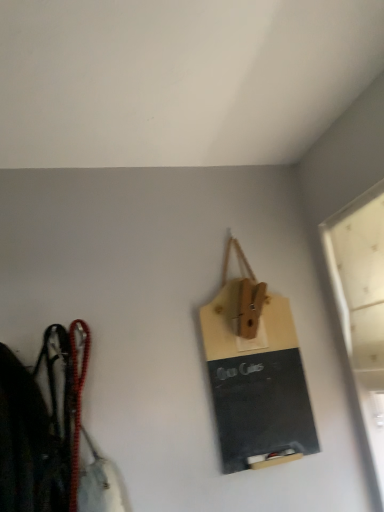
Describe the element at coordinates (256, 374) in the screenshot. This screenshot has height=512, width=384. I see `matte black chalkboard at center` at that location.

Image resolution: width=384 pixels, height=512 pixels. I want to click on matte black chalkboard at center, so click(256, 374).

Image resolution: width=384 pixels, height=512 pixels. What do you see at coordinates (362, 305) in the screenshot?
I see `white frosted glass window at upper right` at bounding box center [362, 305].

Measure the distance between point (372, 400) and camera.

Point (372, 400) is 1.23 meters away from camera.

You are a GUI agent. You are given a task and a screenshot of the screen. Output one action in this format:
    pyautogui.click(x=<x>, y=<y>)
    Task: Click on the white frosted glass window at upper right
    
    Given the screenshot: What is the action you would take?
    pyautogui.click(x=362, y=305)

At what (x,y) coordinates should I click in order to perform the action: click on matte black chalkboard at center. Please return your answer as a coordinate pair (x, y). The image size is (384, 512). Looking at the image, I should click on [x=256, y=374].

Is white frosted glass window at upper right at the right side of matte black chalkboard at center?

Yes.

Which object is further away from the camera taking this photo, white frosted glass window at upper right or matte black chalkboard at center?

matte black chalkboard at center is more distant.

Does point (362, 378) come farther from viewer compared to point (259, 312)?

That is False.

From the image's perspective, between white frosted glass window at upper right and matte black chalkboard at center, which one is located above?

white frosted glass window at upper right.

From a real-world perspective, which object stands above the other?

matte black chalkboard at center, from a real-world perspective.

Considering the sizes of objects white frosted glass window at upper right and matte black chalkboard at center in the image provided, who is wider, white frosted glass window at upper right or matte black chalkboard at center?

white frosted glass window at upper right is wider.

Who is taller, white frosted glass window at upper right or matte black chalkboard at center?

white frosted glass window at upper right.

Based on their sizes in the image, would you say white frosted glass window at upper right is bigger or smaller than matte black chalkboard at center?

In the image, white frosted glass window at upper right appears to be larger than matte black chalkboard at center.

Is white frosted glass window at upper right completely or partially outside of matte black chalkboard at center?

white frosted glass window at upper right is positioned outside matte black chalkboard at center.

Is white frosted glass window at upper right not close to matte black chalkboard at center?

white frosted glass window at upper right is near matte black chalkboard at center, not far away.

Is white frosted glass window at upper right looking in the opposite direction of matte black chalkboard at center?

No, matte black chalkboard at center is not at the back of white frosted glass window at upper right.

How many degrees apart are the facing directions of white frosted glass window at upper right and matte black chalkboard at center?

The angular difference between white frosted glass window at upper right and matte black chalkboard at center is 89.9 degrees.

The image size is (384, 512). I want to click on handbag on the left of the white frosted glass window at upper right, so coord(256,374).

Based on the photo, which is more to the right, matte black chalkboard at center or white frosted glass window at upper right?

white frosted glass window at upper right is more to the right.

Which object is further away from the camera taking this photo, matte black chalkboard at center or white frosted glass window at upper right?

matte black chalkboard at center is behind.

Is point (208, 309) positioned after point (346, 210)?

Yes, point (208, 309) is behind point (346, 210).

From the image's perspective, would you say matte black chalkboard at center is shown under white frosted glass window at upper right?

Yes.

From a real-world perspective, who is located higher, matte black chalkboard at center or white frosted glass window at upper right?

matte black chalkboard at center, from a real-world perspective.

Considering the relative sizes of matte black chalkboard at center and white frosted glass window at upper right in the image provided, is matte black chalkboard at center wider than white frosted glass window at upper right?

In fact, matte black chalkboard at center might be narrower than white frosted glass window at upper right.

Which of these two, matte black chalkboard at center or white frosted glass window at upper right, stands shorter?

matte black chalkboard at center.

Which of these two, matte black chalkboard at center or white frosted glass window at upper right, is smaller?

matte black chalkboard at center.

Is matte black chalkboard at center completely or partially outside of white frosted glass window at upper right?

Absolutely, matte black chalkboard at center is external to white frosted glass window at upper right.

In the scene shown: Is matte black chalkboard at center placed right next to white frosted glass window at upper right?

matte black chalkboard at center and white frosted glass window at upper right are not in contact.

Is matte black chalkboard at center turned away from white frosted glass window at upper right?

No, white frosted glass window at upper right is not at the back of matte black chalkboard at center.

What's the angular difference between matte black chalkboard at center and white frosted glass window at upper right's facing directions?

matte black chalkboard at center and white frosted glass window at upper right are facing 89.9 degrees away from each other.

Where is `handbag located above the white frosted glass window at upper right (from a real-world perspective)`? The width and height of the screenshot is (384, 512). handbag located above the white frosted glass window at upper right (from a real-world perspective) is located at coordinates (256, 374).

This screenshot has height=512, width=384. Identify the location of window in front of the matte black chalkboard at center. point(362,305).

Find the location of a particular element. The width and height of the screenshot is (384, 512). handbag below the white frosted glass window at upper right (from the image's perspective) is located at coordinates (256, 374).